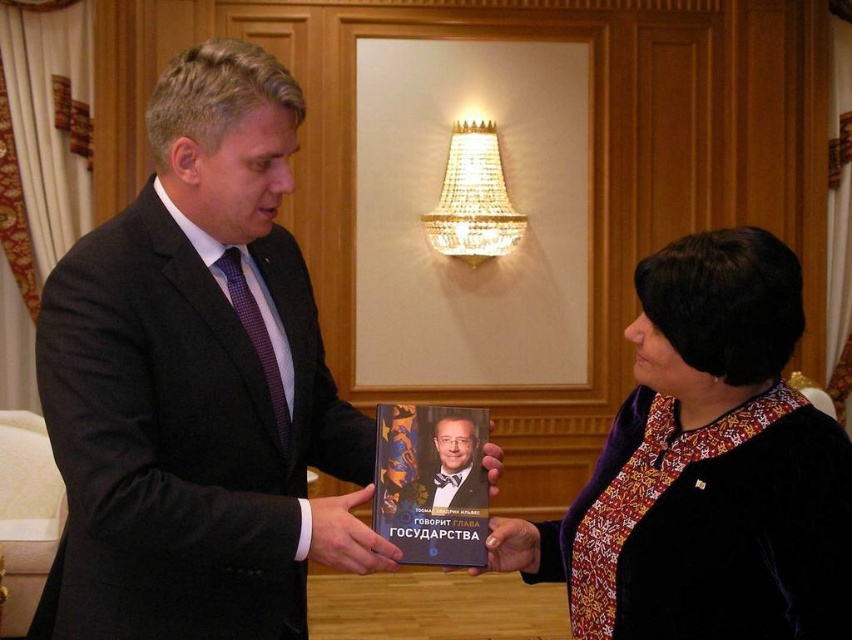
Consider the image. You are a photographer standing 6 feet away from the camera. You want to take a picture of the smooth black bow tie at center without moving the camera. Is it possible to do so while staying in your current position?

The smooth black bow tie at center and camera are 5.32 feet apart from each other. Since you are 6 feet away from the camera, the distance between you and the bow tie would be 6 feet plus 5.32 feet, totaling 11.32 feet. Therefore, you cannot take a picture of the smooth black bow tie at center without moving the camera while staying in your current position.

You are a photographer taking a picture of the smooth black bow tie at center and the matte black book at center. Which object should you focus on first if you want to capture both in focus, considering their sizes?

The smooth black bow tie at center is much taller than the matte black book at center, so you should focus on the taller object first to ensure both are in focus.